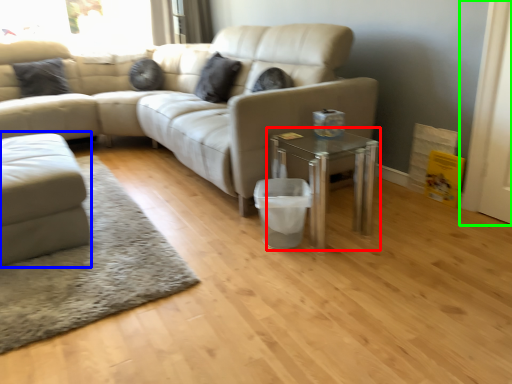
Question: Which object is the closest to the table (highlighted by a red box)? Choose among these: studio couch (highlighted by a blue box) or screen door (highlighted by a green box).

Choices:
 (A) studio couch
 (B) screen door

Answer: (B)